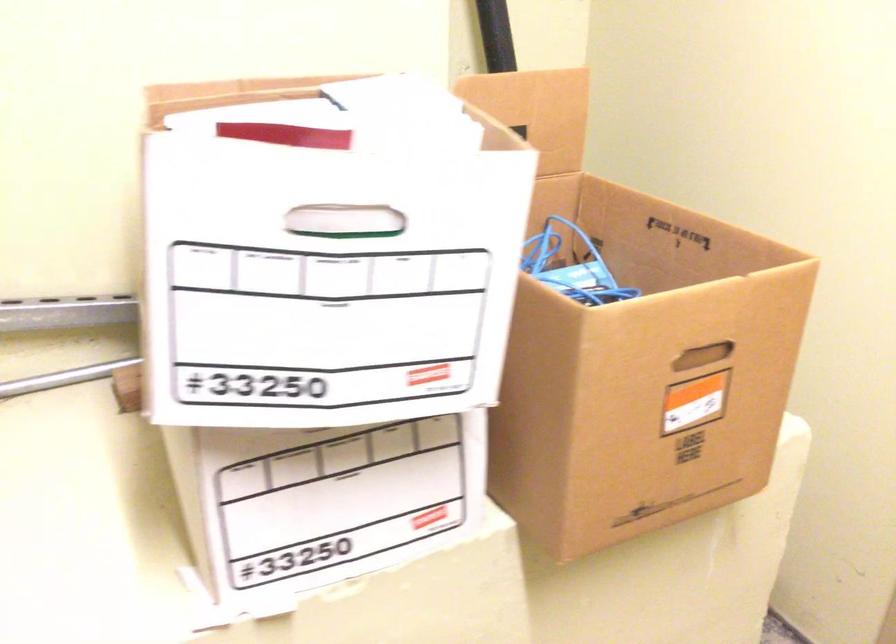
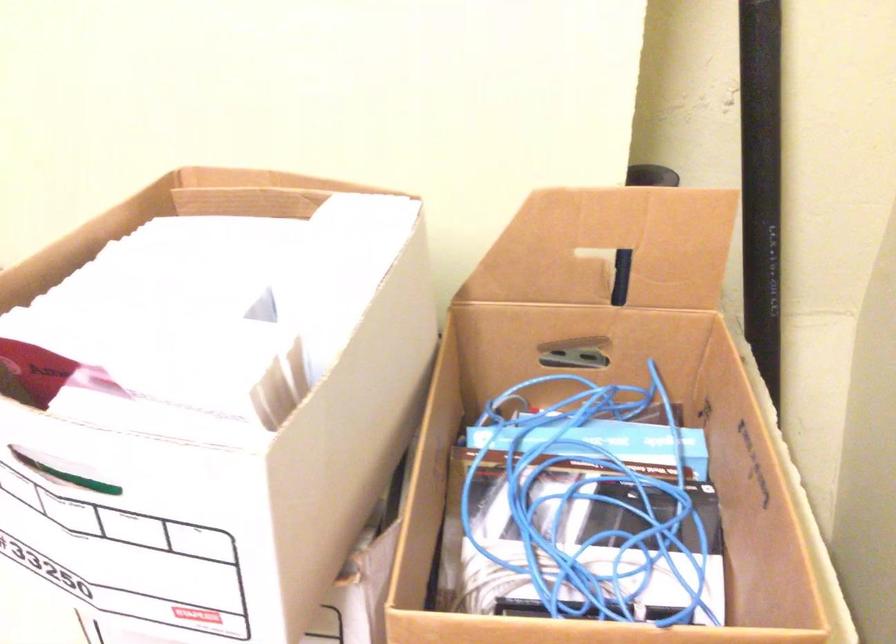
Question: The camera is either moving clockwise (left) or counter-clockwise (right) around the object. The first image is from the beginning of the video and the second image is from the end. Is the camera moving left or right when shooting the video?

Choices:
 (A) Left
 (B) Right

Answer: (B)